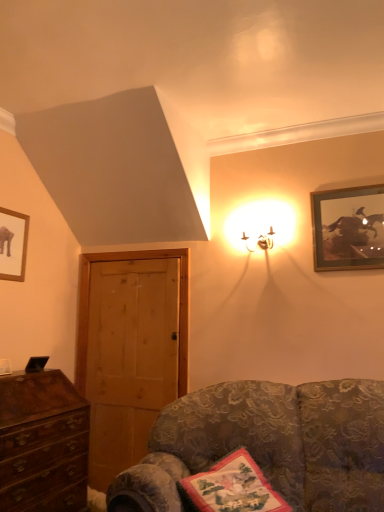
You are a GUI agent. You are given a task and a screenshot of the screen. Output one action in this format:
    pyautogui.click(x=<x>, y=<y>)
    Task: Click on the vacant point above wooden door at left (from a real-world perspective)
    The height and width of the screenshot is (512, 384).
    Given the screenshot: What is the action you would take?
    pyautogui.click(x=132, y=261)